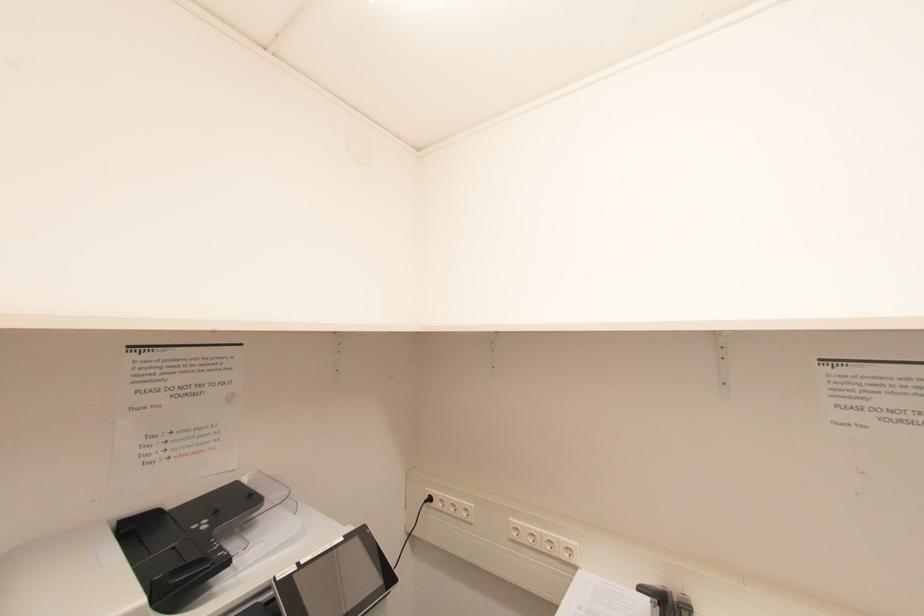
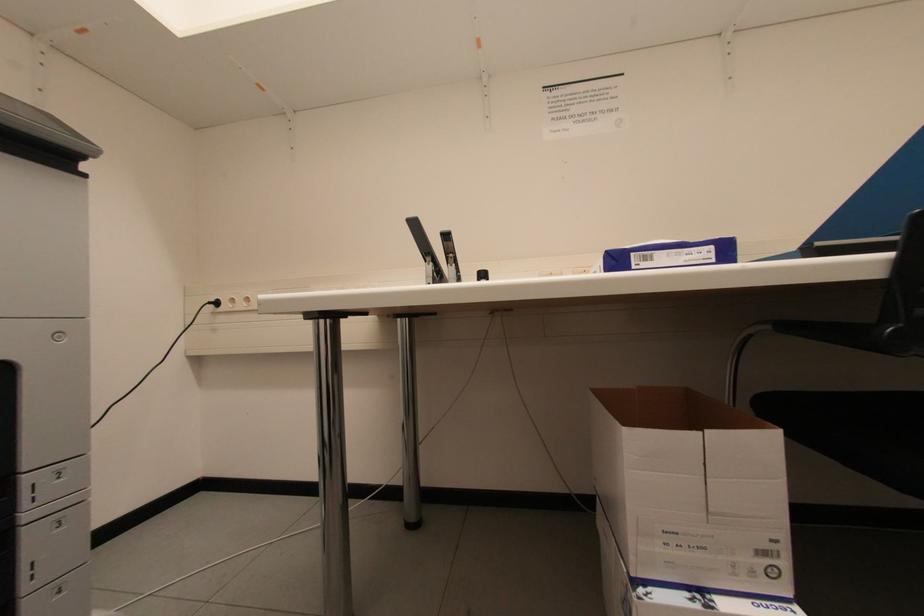
Question: How did the camera likely rotate?

Choices:
 (A) Left
 (B) Right
 (C) Up
 (D) Down

Answer: (B)